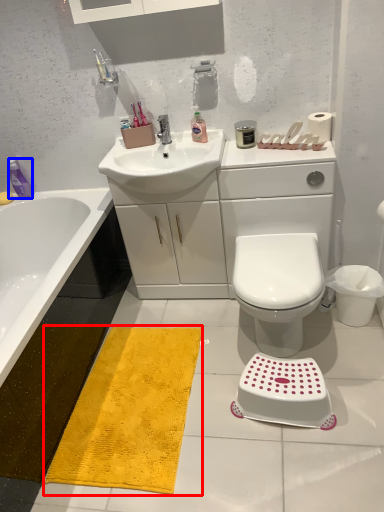
Question: Among these objects, which one is nearest to the camera, doormat (highlighted by a red box) or toiletry (highlighted by a blue box)?

Choices:
 (A) doormat
 (B) toiletry

Answer: (A)